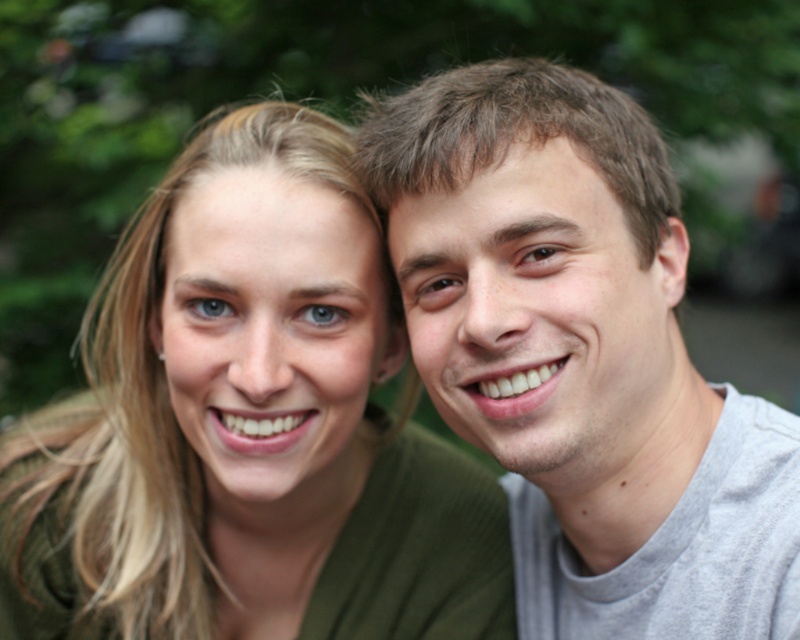
Who is higher up, matte green shirt at center or gray cotton t-shirt at upper right?

gray cotton t-shirt at upper right

Is matte green shirt at center below gray cotton t-shirt at upper right?

Yes.

Between point (312, 179) and point (466, 156), which one is positioned in front?

Point (466, 156) is more forward.

You are a GUI agent. You are given a task and a screenshot of the screen. Output one action in this format:
    pyautogui.click(x=<x>, y=<y>)
    Task: Click on the matte green shirt at center
    
    Given the screenshot: What is the action you would take?
    pyautogui.click(x=246, y=426)